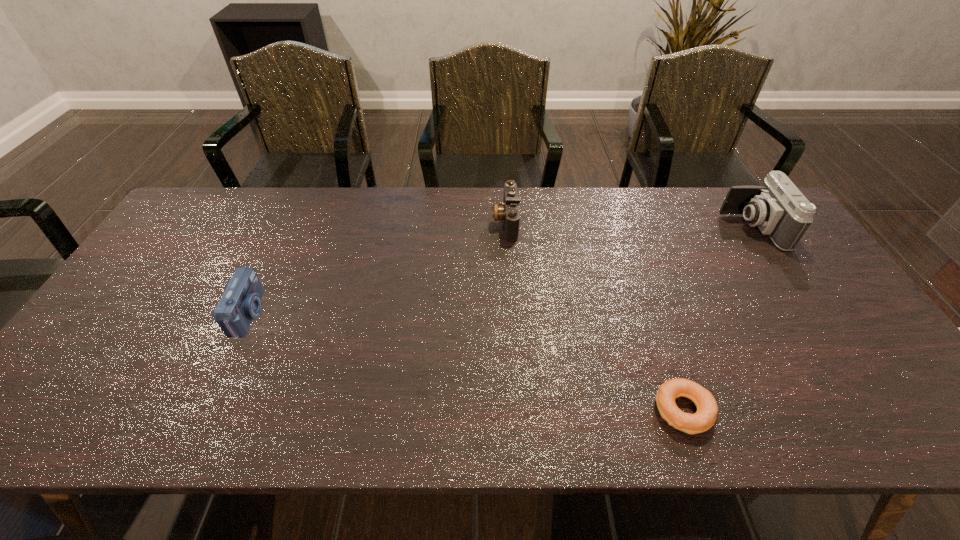
The image size is (960, 540). What are the coordinates of `free space located on the front-facing side of the third object from right to left` in the screenshot? It's located at (474, 221).

Identify the location of free space located 0.190m on the front-facing side of the third object from right to left. (434, 221).

Find the location of `free space located on the front-facing side of the third object from right to left`. free space located on the front-facing side of the third object from right to left is located at coordinates (449, 221).

Locate an element on the screen. free space located 0.390m on the lens of the leftmost camera is located at coordinates (411, 314).

Where is `vacant space situated on the right of the shortest object`? Image resolution: width=960 pixels, height=540 pixels. vacant space situated on the right of the shortest object is located at coordinates coord(850,410).

Where is `object at the near edge`? object at the near edge is located at coordinates pyautogui.click(x=707, y=409).

The width and height of the screenshot is (960, 540). I want to click on object present at the right edge, so click(x=778, y=208).

Find the location of a particular element. The width and height of the screenshot is (960, 540). object situated at the far right corner is located at coordinates (778, 208).

The image size is (960, 540). In the image, there is a desktop. Find the location of `vacant space at the far edge`. vacant space at the far edge is located at coordinates (372, 225).

Identify the location of vacant space at the near edge of the desktop. (637, 406).